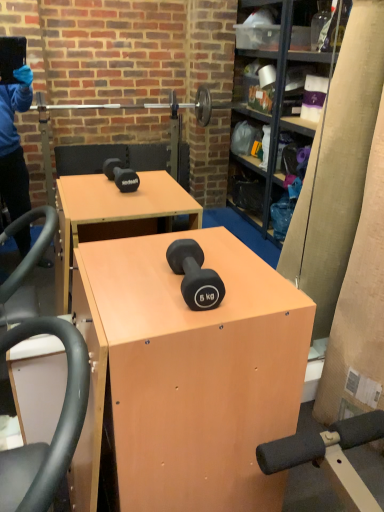
Locate an element on the screen. The width and height of the screenshot is (384, 512). vacant space positioned to the left of matte black dumbbell at center is located at coordinates (129, 284).